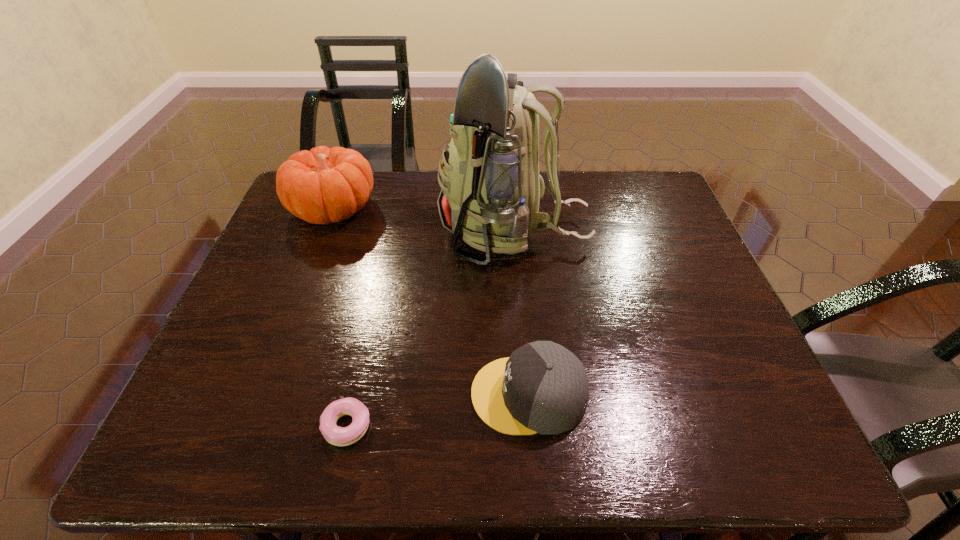
The height and width of the screenshot is (540, 960). In the image, there is a desktop. In order to click on free space at the far edge in this screenshot , I will do `click(615, 199)`.

Identify the location of vacant region at the left edge of the desktop. click(291, 314).

The image size is (960, 540). In the image, there is a desktop. Identify the location of vacant space at the right edge. (722, 398).

Locate an element on the screen. This screenshot has height=540, width=960. vacant region at the near left corner of the desktop is located at coordinates (172, 429).

In the image, there is a desktop. Identify the location of free space at the far right corner. (647, 189).

This screenshot has width=960, height=540. What are the coordinates of `vacant space that's between the cap and the second tallest object` in the screenshot? It's located at (431, 302).

This screenshot has width=960, height=540. Identify the location of vacant area that lies between the shortest object and the third tallest object. (438, 410).

Where is `empty space between the cap and the tallest object`? The width and height of the screenshot is (960, 540). empty space between the cap and the tallest object is located at coordinates (521, 313).

I want to click on free area in between the doughnut and the cap, so click(x=438, y=410).

Locate an element on the screen. Image resolution: width=960 pixels, height=540 pixels. vacant region between the leftmost object and the cap is located at coordinates (431, 302).